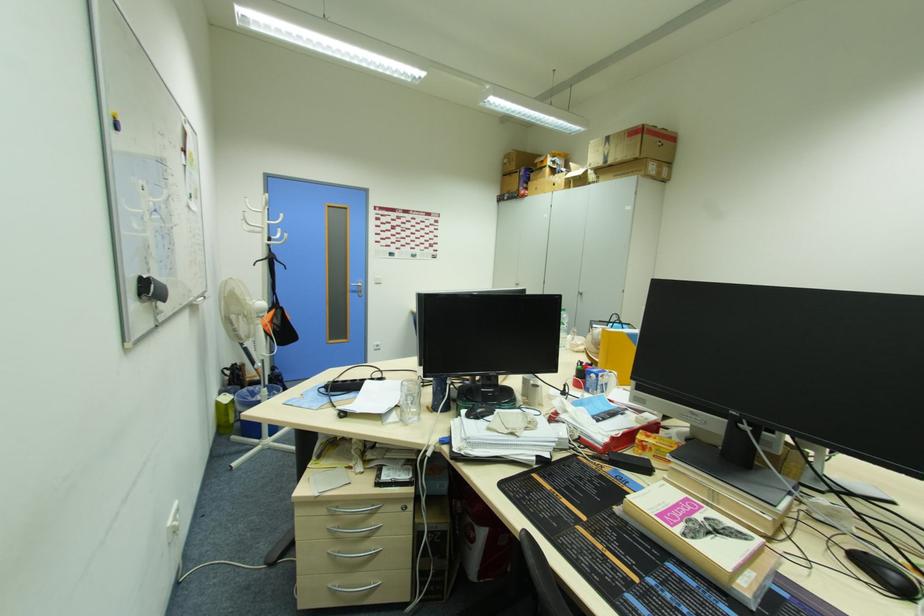
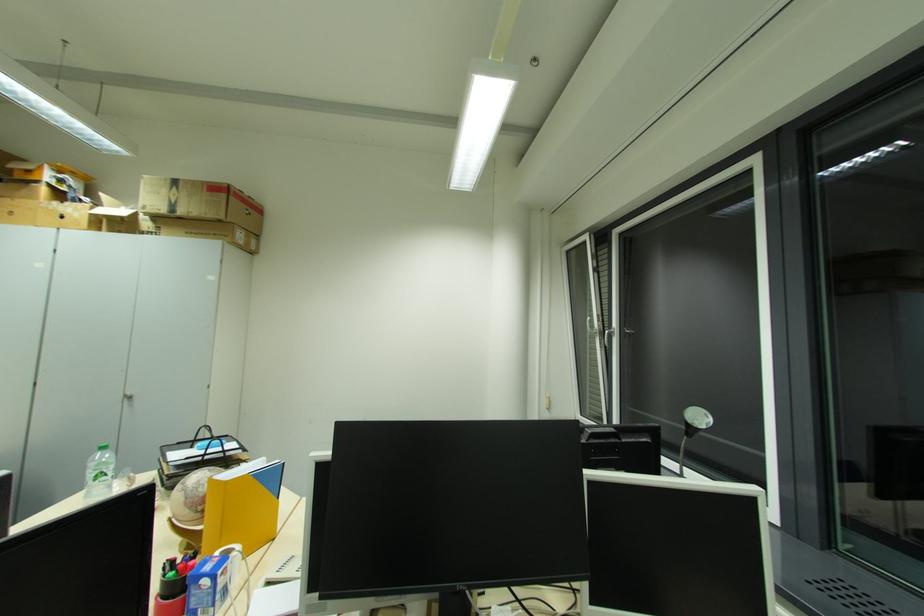
The point at (596, 342) is marked in the first image. Where is the corresponding point in the second image?

(189, 506)